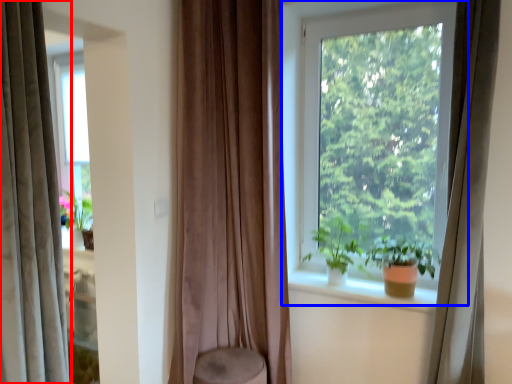
Question: Which of the following is the farthest to the observer, curtain (highlighted by a red box) or window (highlighted by a blue box)?

Choices:
 (A) curtain
 (B) window

Answer: (B)